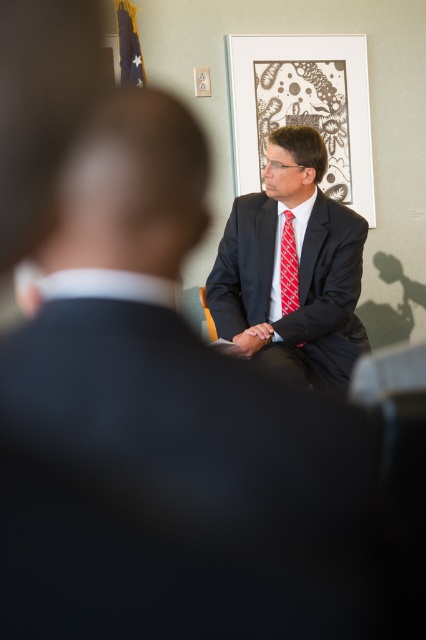
Question: Is matte black suit at center below red checkered tie at center?

Choices:
 (A) no
 (B) yes

Answer: (A)

Question: Which point is farther from the camera taking this photo?

Choices:
 (A) (314, 102)
 (B) (299, 323)
 (C) (288, 273)

Answer: (A)

Question: Is matte paper picture frame at upper center to the left of red checkered tie at center from the viewer's perspective?

Choices:
 (A) no
 (B) yes

Answer: (A)

Question: Is matte black suit at center bigger than red checkered tie at center?

Choices:
 (A) no
 (B) yes

Answer: (B)

Question: Which object is closer to the camera taking this photo?

Choices:
 (A) matte paper picture frame at upper center
 (B) red checkered tie at center
 (C) matte black suit at center

Answer: (C)

Question: Among these points, which one is nearest to the camera?

Choices:
 (A) (281, 294)
 (B) (281, 262)
 (C) (354, 96)

Answer: (B)